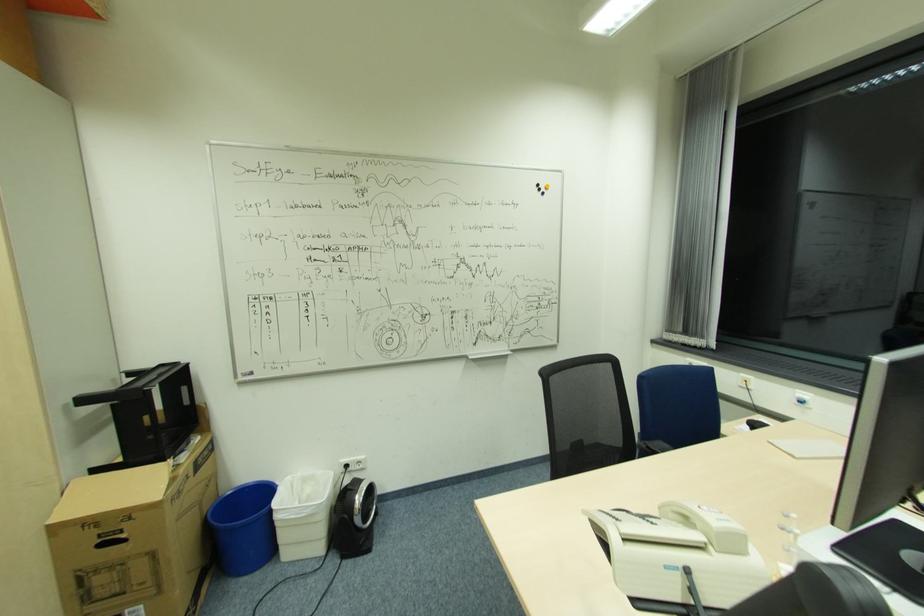
This screenshot has width=924, height=616. Describe the element at coordinates (112, 492) in the screenshot. I see `the cardboard box handle` at that location.